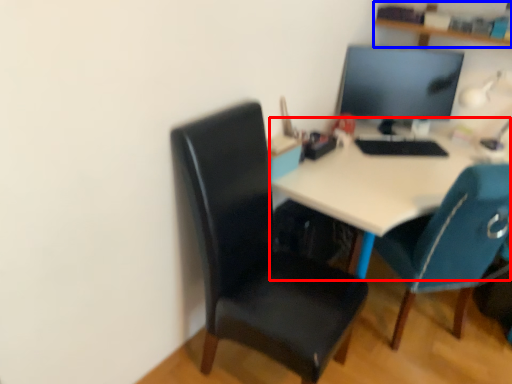
Question: Which object appears farthest to the camera in this image, desk (highlighted by a red box) or shelf (highlighted by a blue box)?

Choices:
 (A) desk
 (B) shelf

Answer: (B)